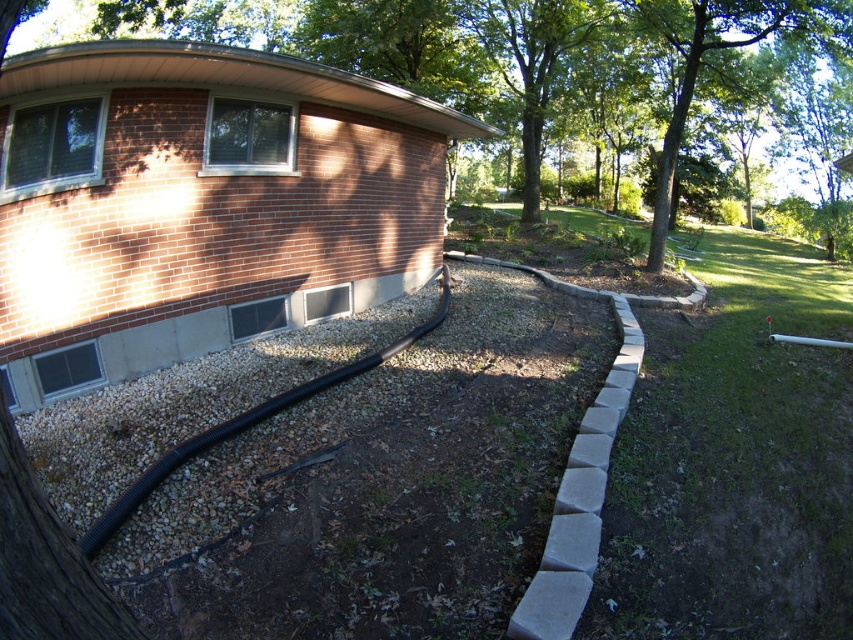
Question: Is gray gravel at lower left to the right of brown brick tree at upper center from the viewer's perspective?

Choices:
 (A) yes
 (B) no

Answer: (B)

Question: Is brown brick tree at upper center to the right of black rubber garden hose at lower left from the viewer's perspective?

Choices:
 (A) no
 (B) yes

Answer: (B)

Question: Among these points, which one is nearest to the camera?

Choices:
 (A) (677, 28)
 (B) (445, 291)

Answer: (B)

Question: Which point is farther to the camera?

Choices:
 (A) black rubber garden hose at lower left
 (B) green leafy tree at upper right
 (C) brown brick tree at upper center
 (D) gray gravel at lower left

Answer: (B)

Question: Which of the following is the closest to the observer?

Choices:
 (A) brown brick tree at upper center
 (B) gray gravel at lower left
 (C) green leafy tree at upper right
 (D) black rubber garden hose at lower left

Answer: (A)

Question: Can you confirm if green leafy tree at upper right is positioned below black rubber garden hose at lower left?

Choices:
 (A) no
 (B) yes

Answer: (A)